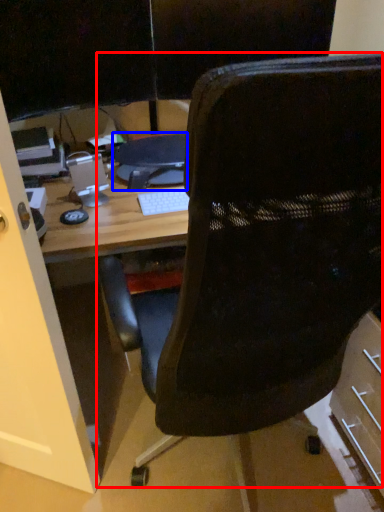
Question: Which of the following is the closest to the observer, chair (highlighted by a red box) or computer (highlighted by a blue box)?

Choices:
 (A) chair
 (B) computer

Answer: (A)